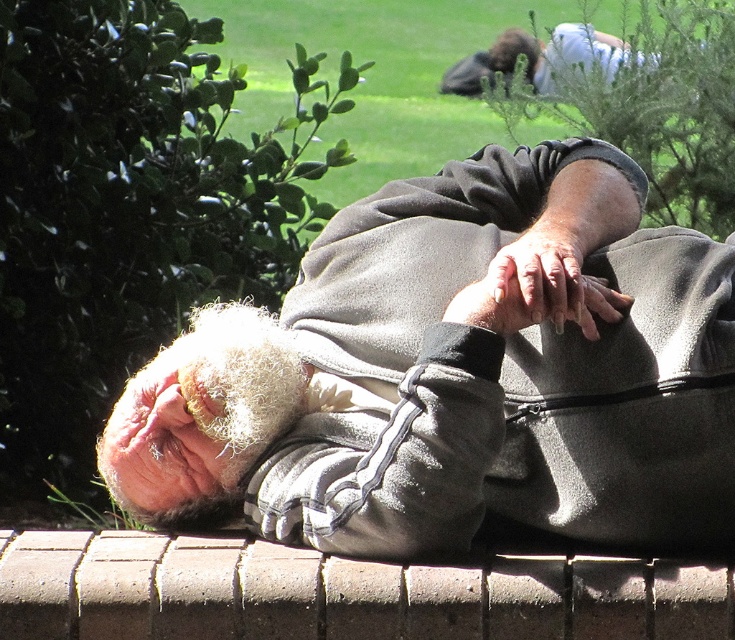
From the picture: Who is lower down, brick at lower center or fuzzy brown hair at upper center?

Positioned lower is brick at lower center.

Who is positioned more to the left, brick at lower center or fuzzy brown hair at upper center?

Positioned to the left is brick at lower center.

In order to click on brick at lower center in this screenshot , I will do `click(340, 593)`.

Find the location of `brick at lower center`. brick at lower center is located at coordinates (340, 593).

Can you confirm if gray fleece jacket at center is smaller than brick at lower center?

Incorrect, gray fleece jacket at center is not smaller in size than brick at lower center.

Between gray fleece jacket at center and brick at lower center, which one is positioned higher?

gray fleece jacket at center is higher up.

Does point (702, 508) come in front of point (301, 579)?

That is True.

Identify the location of gray fleece jacket at center. (465, 374).

How distant is white fuzzy beard at center from fuzzy brown hair at upper center?

The distance of white fuzzy beard at center from fuzzy brown hair at upper center is 2.53 meters.

Who is taller, white fuzzy beard at center or fuzzy brown hair at upper center?

With more height is white fuzzy beard at center.

Which is behind, point (151, 390) or point (520, 29)?

Positioned behind is point (520, 29).

Find the location of a particular element. The image size is (735, 640). white fuzzy beard at center is located at coordinates (201, 417).